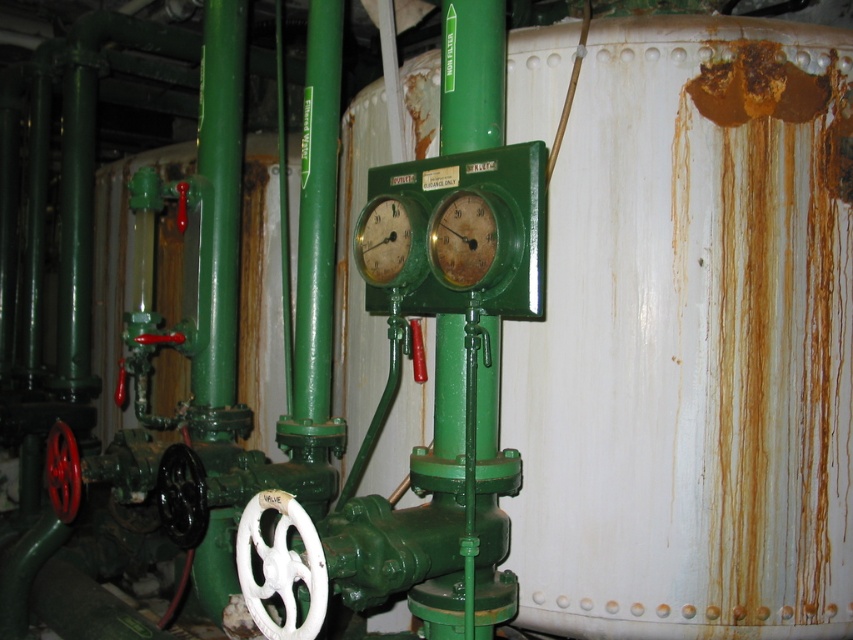
Does point (454, 269) lie behind point (421, 244)?

No, it is in front of (421, 244).

Can you confirm if rusty metal gauge at center is shorter than green matte gauge at center?

Yes, rusty metal gauge at center is shorter than green matte gauge at center.

The image size is (853, 640). What do you see at coordinates (465, 241) in the screenshot?
I see `rusty metal gauge at center` at bounding box center [465, 241].

This screenshot has height=640, width=853. In order to click on rusty metal gauge at center in this screenshot , I will do `click(465, 241)`.